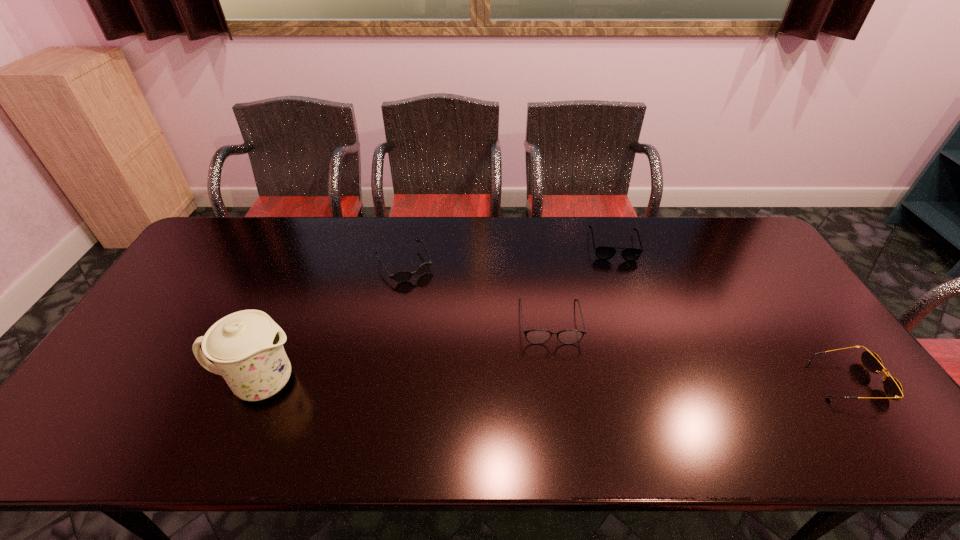
The image size is (960, 540). I want to click on spectacles situated at the far edge, so click(604, 253).

The width and height of the screenshot is (960, 540). I want to click on sunglasses that is positioned at the far edge, so click(402, 276).

Where is `chinaware present at the near edge`? This screenshot has height=540, width=960. chinaware present at the near edge is located at coordinates (246, 347).

Locate an element on the screen. The height and width of the screenshot is (540, 960). sunglasses at the near edge is located at coordinates (893, 389).

At what (x,y) coordinates should I click in order to perform the action: click on object present at the right edge. Please return your answer as a coordinate pair (x, y). Looking at the image, I should click on (893, 389).

The height and width of the screenshot is (540, 960). In order to click on object present at the near right corner in this screenshot , I will do `click(893, 389)`.

You are a GUI agent. You are given a task and a screenshot of the screen. Output one action in this format:
    pyautogui.click(x=<x>, y=<y>)
    Task: Click on the blank area at the far edge
    This screenshot has width=960, height=540.
    Given the screenshot: What is the action you would take?
    pyautogui.click(x=430, y=252)

Find the location of a particular element. The width and height of the screenshot is (960, 540). vacant space at the near edge of the desktop is located at coordinates (376, 412).

Find the location of a particular element. free location at the left edge of the desktop is located at coordinates (198, 299).

This screenshot has height=540, width=960. In the image, there is a desktop. Find the location of `free space at the right edge`. free space at the right edge is located at coordinates (759, 267).